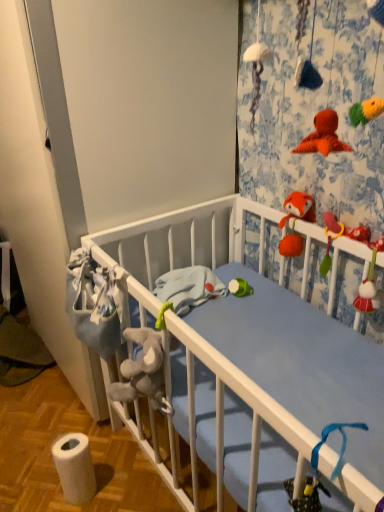
Find the location of a particular element. vacant space positioned to the left of white matte toilet paper at lower left is located at coordinates (34, 484).